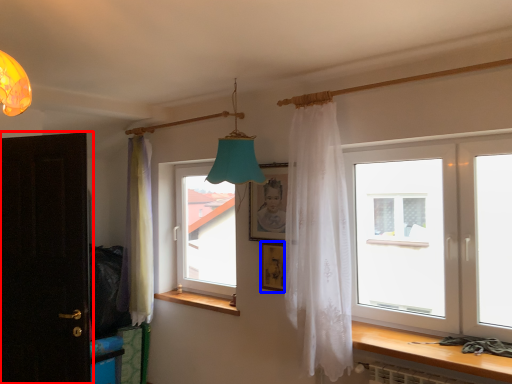
Question: Which object appears closest to the camera in this image, door (highlighted by a red box) or picture frame (highlighted by a blue box)?

Choices:
 (A) door
 (B) picture frame

Answer: (A)